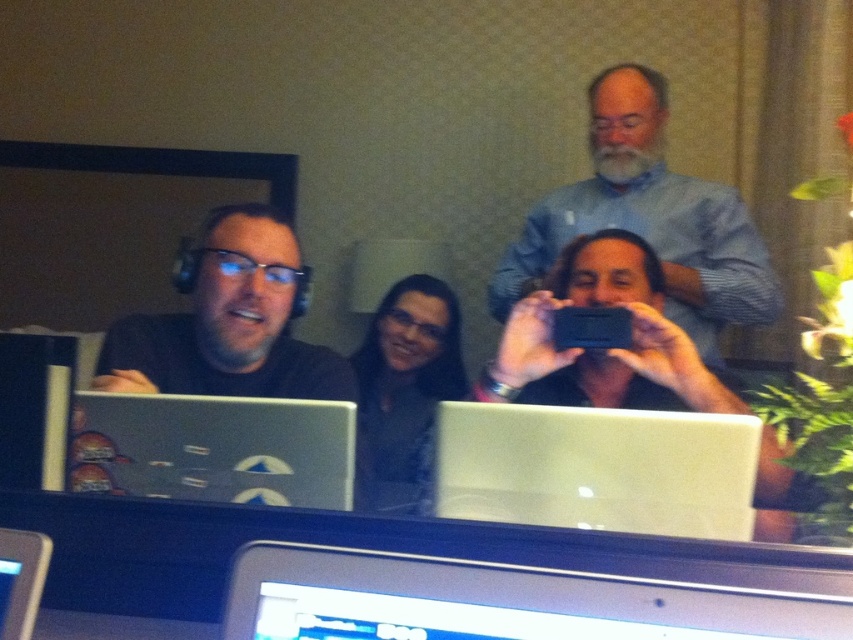
Question: Can you confirm if silver metallic laptop at center is smaller than blue striped shirt at upper center?

Choices:
 (A) yes
 (B) no

Answer: (A)

Question: Based on their relative distances, which object is nearer to the blue striped shirt at upper center?

Choices:
 (A) silver metallic laptop at center
 (B) silver metallic monitor at lower center

Answer: (A)

Question: Can you confirm if silver metallic laptop at center is positioned to the left of matte black phone at center?

Choices:
 (A) no
 (B) yes

Answer: (B)

Question: Which point appears closest to the camera in this image?

Choices:
 (A) (550, 520)
 (B) (596, 118)
 (C) (453, 304)
 (D) (637, 385)

Answer: (A)

Question: Can you confirm if silver metallic monitor at lower center is bigger than matte black phone at center?

Choices:
 (A) yes
 (B) no

Answer: (B)

Question: Among these points, which one is nearest to the camera?

Choices:
 (A) (717, 445)
 (B) (404, 307)
 (C) (743, 224)
 (D) (335, 465)

Answer: (A)